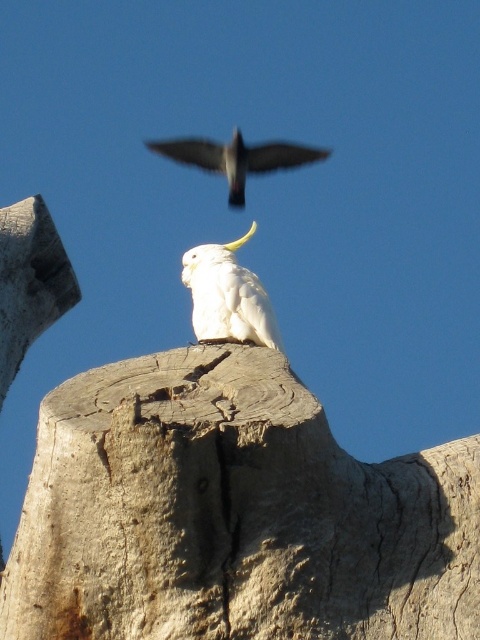
Question: Where is light brown rough wood at center located in relation to white matte parrot at center in the image?

Choices:
 (A) below
 (B) above

Answer: (A)

Question: From the image, what is the correct spatial relationship of white matte parrot at center in relation to matte black bird at upper center?

Choices:
 (A) above
 (B) below

Answer: (B)

Question: Is white matte parrot at center smaller than matte black bird at upper center?

Choices:
 (A) no
 (B) yes

Answer: (A)

Question: Which is farther from the white matte parrot at center?

Choices:
 (A) light brown rough wood at center
 (B) matte black bird at upper center

Answer: (A)

Question: Which object appears closest to the camera in this image?

Choices:
 (A) matte black bird at upper center
 (B) white matte parrot at center

Answer: (B)

Question: Considering the real-world distances, which object is closest to the matte black bird at upper center?

Choices:
 (A) white matte parrot at center
 (B) light brown rough wood at center

Answer: (A)